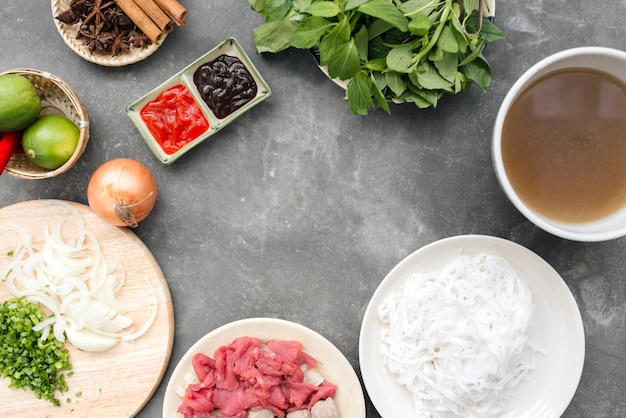
This screenshot has height=418, width=626. I want to click on wooden cutting board, so click(x=113, y=378).